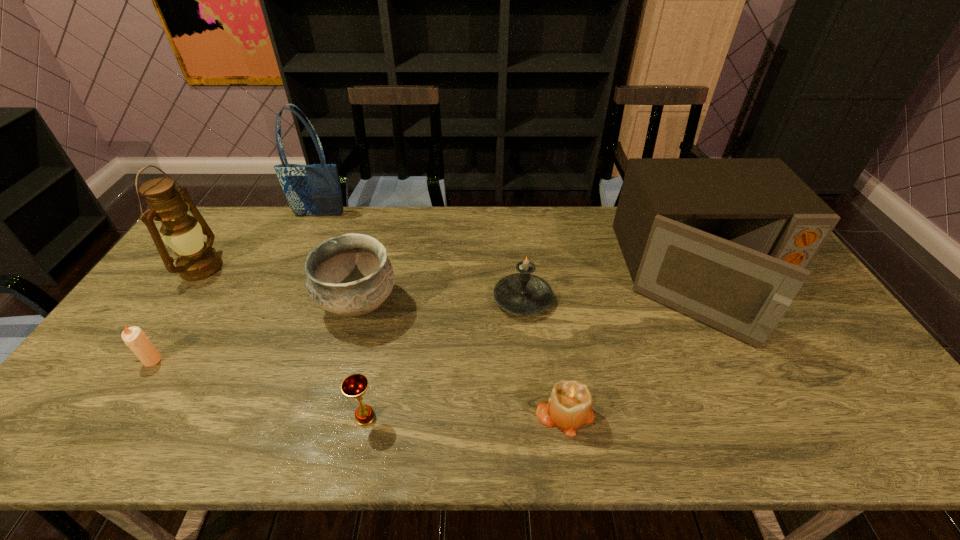
Identify the location of chalice that is at the near edge. (354, 386).

At what (x,y) coordinates should I click in order to perform the action: click on candle at the near edge. Please return your answer as a coordinate pair (x, y). Image resolution: width=960 pixels, height=540 pixels. Looking at the image, I should click on (569, 407).

I want to click on oil lamp that is positioned at the left edge, so click(x=197, y=260).

Identify the location of candle that is at the left edge. The width and height of the screenshot is (960, 540). (134, 337).

The height and width of the screenshot is (540, 960). Identify the location of object that is at the right edge. (728, 241).

Image resolution: width=960 pixels, height=540 pixels. Identify the location of object at the far right corner. (728, 241).

Where is `free space at the far edge of the desktop`? The image size is (960, 540). free space at the far edge of the desktop is located at coordinates (547, 211).

Find the location of a particular element. This screenshot has height=540, width=960. vacant area at the near edge is located at coordinates (401, 427).

You are a GUI agent. You are given a task and a screenshot of the screen. Output one action in this format:
    pyautogui.click(x=<x>, y=<y>)
    Task: Click on the blank area at the left edge
    The width and height of the screenshot is (960, 540).
    Given the screenshot: What is the action you would take?
    pyautogui.click(x=162, y=309)

The height and width of the screenshot is (540, 960). I want to click on vacant space at the far left corner of the desktop, so click(x=223, y=219).